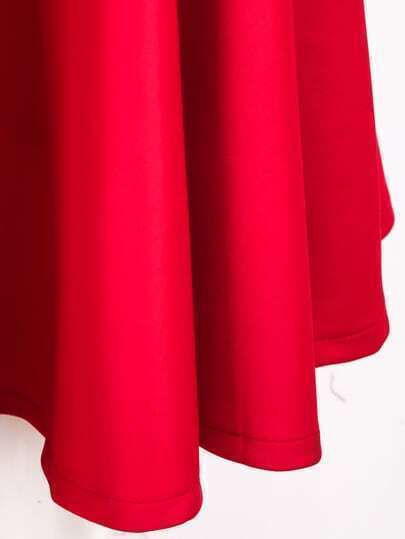
The width and height of the screenshot is (405, 539). I want to click on robe, so click(x=270, y=403).